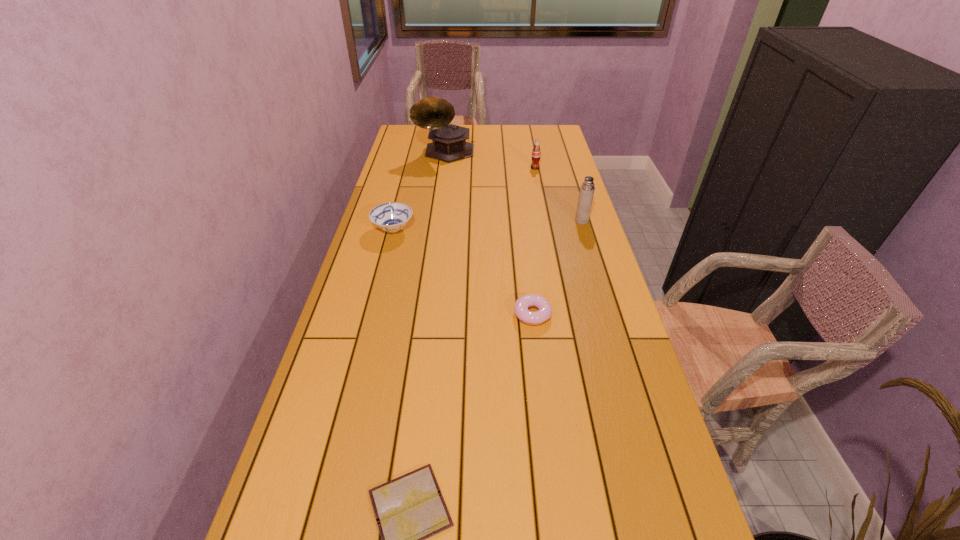
Locate an element on the screen. vacant space situated on the left of the second object from right to left is located at coordinates (463, 168).

This screenshot has width=960, height=540. What are the coordinates of `vacant position located 0.360m on the right of the third shortest object` in the screenshot? It's located at (517, 230).

This screenshot has height=540, width=960. Identify the location of vacant space located on the back of the fourth object from left to right. (522, 230).

The height and width of the screenshot is (540, 960). Find the location of `object that is at the far edge`. object that is at the far edge is located at coordinates (449, 144).

Where is `phonograph record at the left edge`? phonograph record at the left edge is located at coordinates (449, 144).

At what (x,y) coordinates should I click in order to perform the action: click on soup bowl that is at the left edge. Please return your answer as a coordinate pair (x, y). Image resolution: width=960 pixels, height=540 pixels. Looking at the image, I should click on (391, 217).

Locate an element on the screen. This screenshot has width=960, height=540. thermos bottle at the right edge is located at coordinates (587, 189).

I want to click on soda at the right edge, so click(x=536, y=153).

Find the location of a particular element. This screenshot has width=960, height=540. object at the far left corner is located at coordinates (449, 144).

The width and height of the screenshot is (960, 540). In the image, there is a desktop. Find the location of `vacant space at the far edge`. vacant space at the far edge is located at coordinates (483, 133).